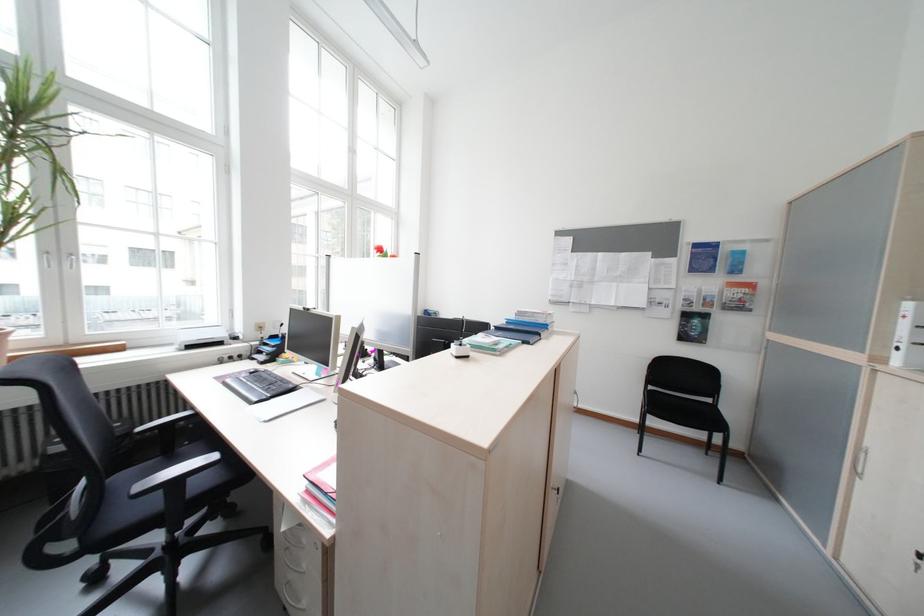
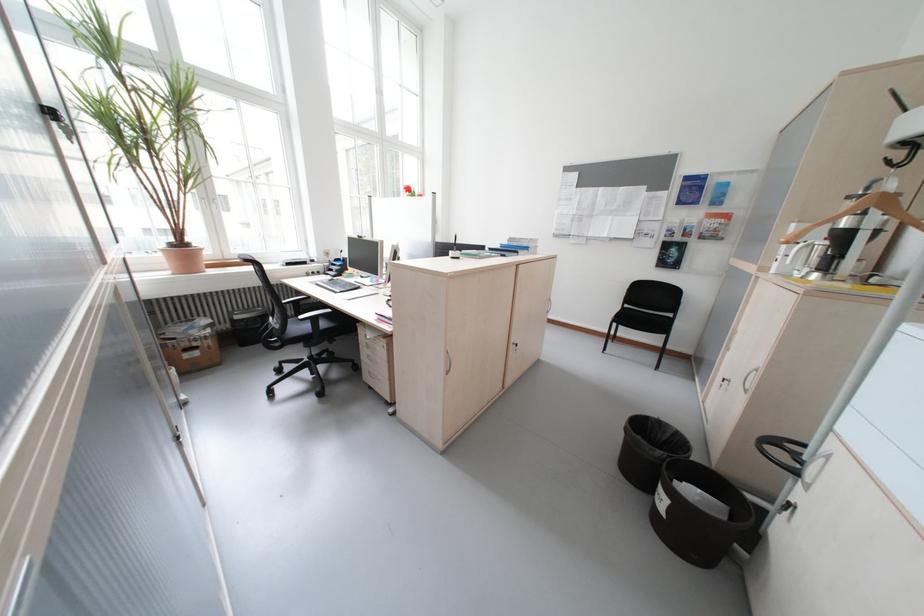
Question: The images are taken continuously from a first-person perspective. In which direction is your viewpoint rotating?

Choices:
 (A) Left
 (B) Right
 (C) Up
 (D) Down

Answer: (D)